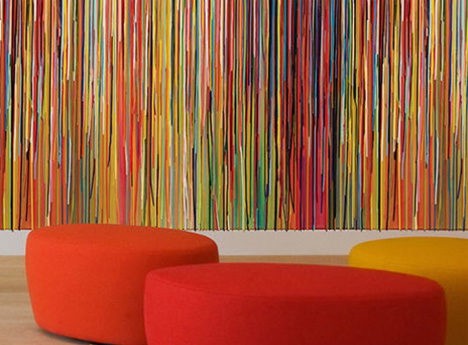
Where is `left of orange ottoman`? The image size is (468, 345). left of orange ottoman is located at coordinates (22, 281).